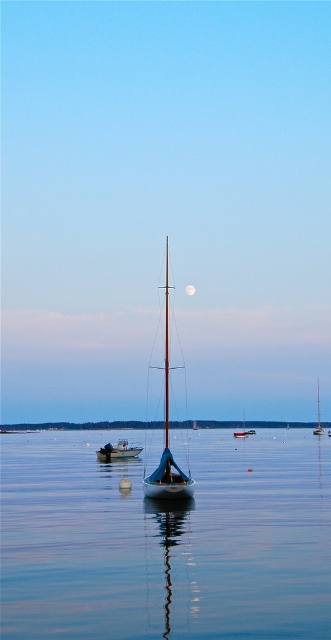
Does wooden sailboat at center come in front of white sailboat at center?

Yes.

Does wooden sailboat at center have a greater height compared to white sailboat at center?

Correct, wooden sailboat at center is much taller as white sailboat at center.

Where is `wooden sailboat at center`? Image resolution: width=331 pixels, height=640 pixels. wooden sailboat at center is located at coordinates (167, 429).

Is wooden sailboat at center taller than blue water at center?

No.

Between point (166, 323) and point (177, 422), which one is positioned behind?

The point (177, 422) is more distant.

Does point (156, 492) come behind point (303, 426)?

No, it is not.

I want to click on wooden sailboat at center, so point(167,429).

Can you confirm if smooth blue water at center is shorter than white sailboat at center?

No, smooth blue water at center is not shorter than white sailboat at center.

Where is `smooth blue water at center`? The image size is (331, 640). smooth blue water at center is located at coordinates (166, 541).